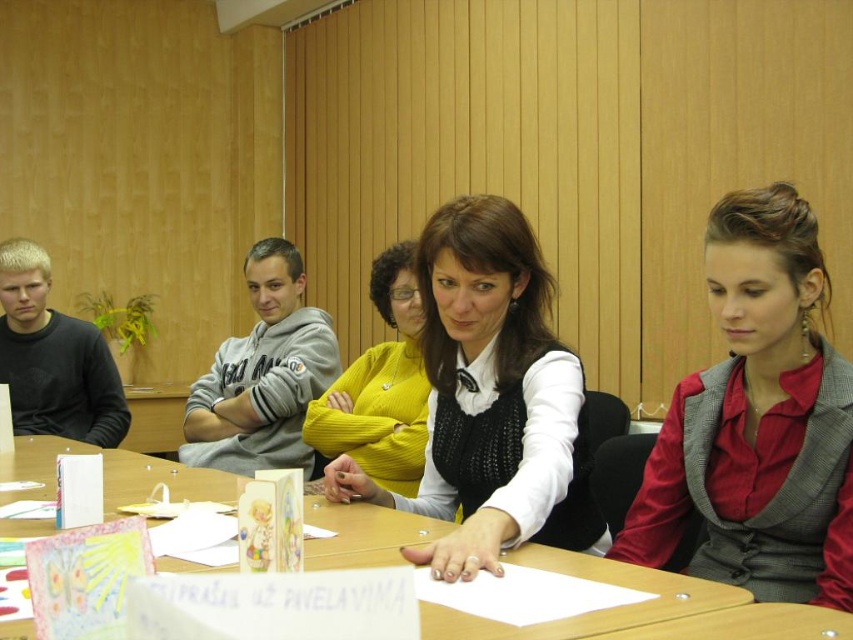
You are organizing a photo shoot and need to place a prop exactly at the center of the image. However, there is already a red fabric vest at center. Can you confirm if the vest is positioned at the exact center coordinates of the image?

The red fabric vest at center is located at point (757,420), which is not the exact center of the image. The exact center would be at coordinates (426,320), so the vest is slightly to the right and bottom of the true center.

You are organizing a photo shoot and need to place two items on a table. The matte black vest at center and the matte yellow sweater at center must be arranged so that the larger item is placed to the right of the smaller one. Which item should be placed on the right side?

The matte black vest at center is larger than the matte yellow sweater at center, so it should be placed on the right side.

Consider the image. You are sitting at the wooden table and want to hand a document to the person wearing the red fabric vest at center and the matte black vest at center. Which person is seated to the right of the other?

The red fabric vest at center is to the right of the matte black vest at center, so the person wearing the red fabric vest at center is seated to the right of the person wearing the matte black vest at center.